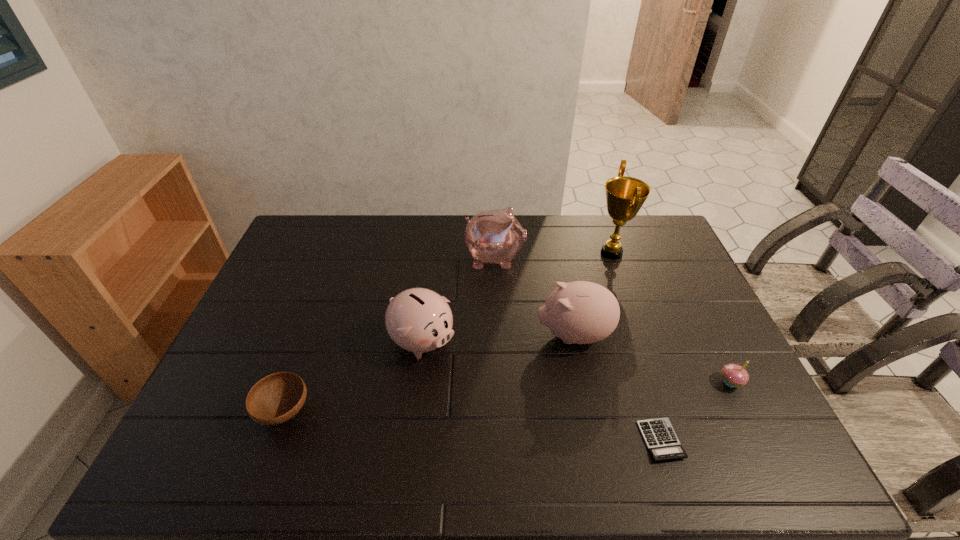
At what (x,y) coordinates should I click in order to perform the action: click on free region located on the front view with handles of the tallest object. Please return your answer as a coordinate pair (x, y). Looking at the image, I should click on (532, 253).

Where is `free location located 0.330m on the front view with handles of the tallest object`? Image resolution: width=960 pixels, height=540 pixels. free location located 0.330m on the front view with handles of the tallest object is located at coordinates (x=497, y=253).

Find the location of a particular element. free spot located 0.280m on the front view with handles of the tallest object is located at coordinates (512, 253).

The width and height of the screenshot is (960, 540). What are the coordinates of `vacant space situated on the front facing side of the fifth object from right to left` in the screenshot? It's located at (540, 258).

The height and width of the screenshot is (540, 960). Find the location of `free space located 0.050m at the snout of the rightmost piggy bank`. free space located 0.050m at the snout of the rightmost piggy bank is located at coordinates (517, 335).

Locate an element on the screen. vacant region located 0.330m at the snout of the rightmost piggy bank is located at coordinates (420, 335).

Find the location of a particular element. This screenshot has height=540, width=960. vacant space located 0.320m at the snout of the rightmost piggy bank is located at coordinates (424, 335).

You are a GUI agent. You are given a task and a screenshot of the screen. Output one action in this format:
    pyautogui.click(x=<x>, y=<y>)
    Task: Click on the free region located on the front of the second object from left to right
    This screenshot has height=540, width=960.
    Given the screenshot: What is the action you would take?
    pyautogui.click(x=411, y=441)

At what (x,y) coordinates should I click in order to perform the action: click on vacant space located on the front of the fifth tallest object. Please return your answer as a coordinate pair (x, y). This screenshot has height=540, width=960. Looking at the image, I should click on (763, 449).

The height and width of the screenshot is (540, 960). I want to click on vacant space located 0.370m on the right of the leftmost object, so click(462, 411).